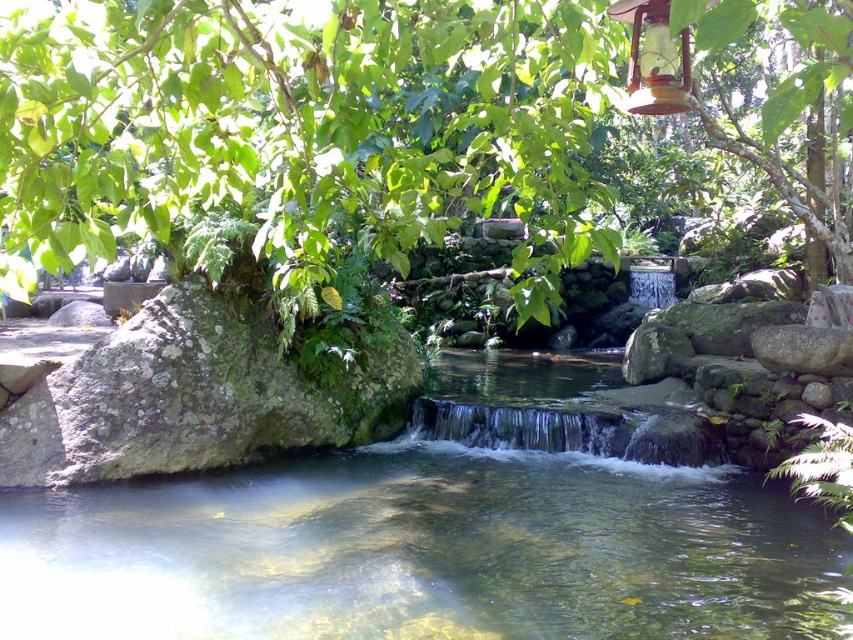
Based on the scene description, what are the coordinates of the green leafy tree at upper center?

The green leafy tree at upper center is located at coordinates (303, 125).

From the picture: You are standing in the garden and want to place a 3.5 feet wide bench between yourself and the green leafy tree at upper center. Can the bench fit in the space without overlapping the tree?

The distance between you and the green leafy tree at upper center is 5.37 feet. Since the bench is 3.5 feet wide, there is enough space to place it without overlapping the tree.

You are a bird flying over the garden. You see the green leafy tree at upper center and the clear water stream at center. Which one is higher from the ground?

The green leafy tree at upper center is located above the clear water stream at center, so it is higher from the ground.